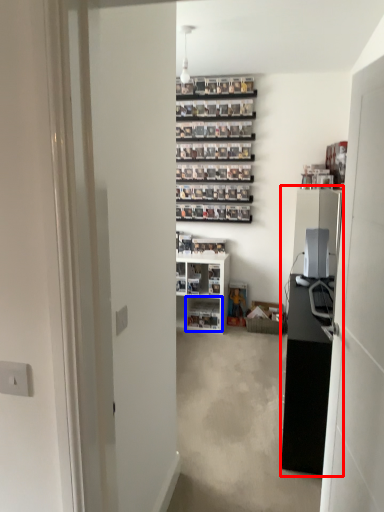
Question: Which object appears farthest to the camera in this image, entertainment center (highlighted by a red box) or shelf (highlighted by a blue box)?

Choices:
 (A) entertainment center
 (B) shelf

Answer: (B)